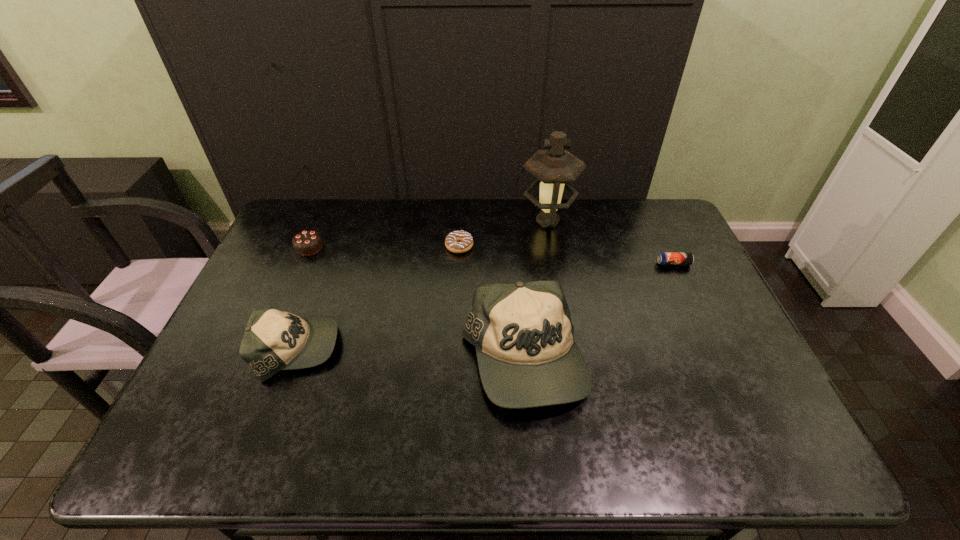
Locate an element on the screen. The width and height of the screenshot is (960, 540). free point that satisfies the following two spatial constraints: 1. on the front side of the oil lamp; 2. on the front-facing side of the fourth shortest object is located at coordinates pyautogui.click(x=571, y=349).